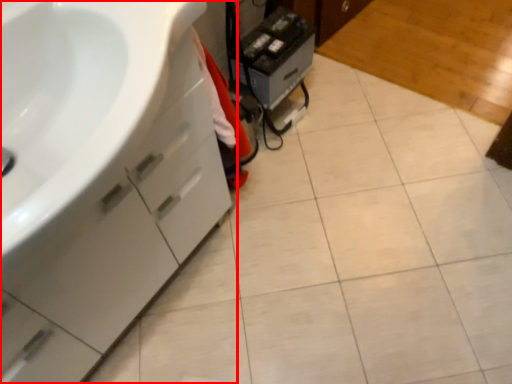
Question: In this image, where is bathroom cabinet (annotated by the red box) located relative to appliance?

Choices:
 (A) right
 (B) left

Answer: (B)